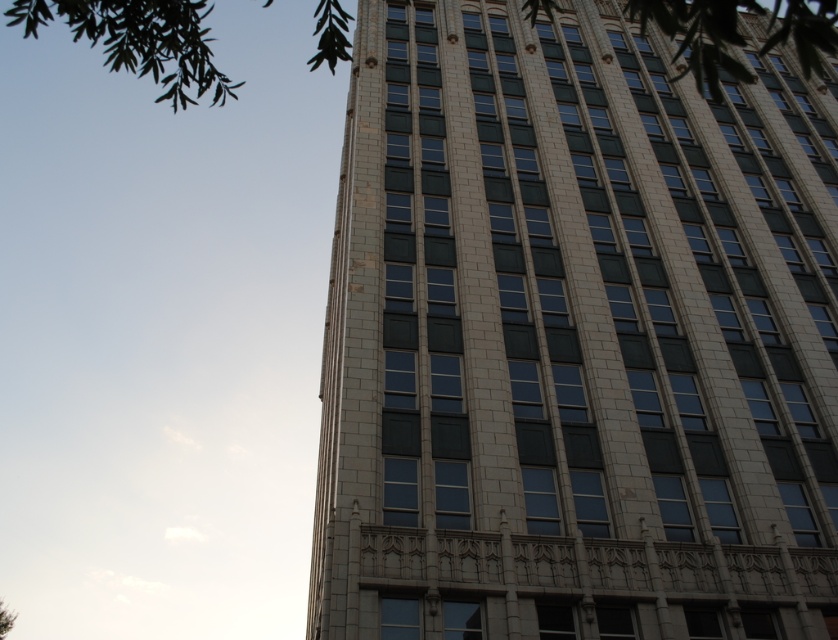
You are standing in a park and see the white stone building at center and the green leafy tree at lower left. Which object is positioned to the right of the other?

The white stone building at center is to the right of green leafy tree at lower left.

Based on the photo, you are an architect analyzing the building layout. From your current viewpoint, which object is closer to you between the white stone building at center and the green leafy tree at upper left?

The white stone building at center is closer to you because the green leafy tree at upper left is positioned behind it.